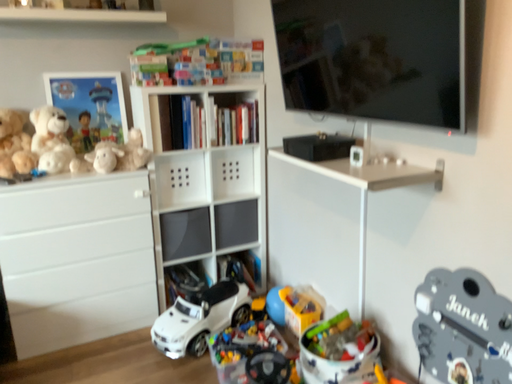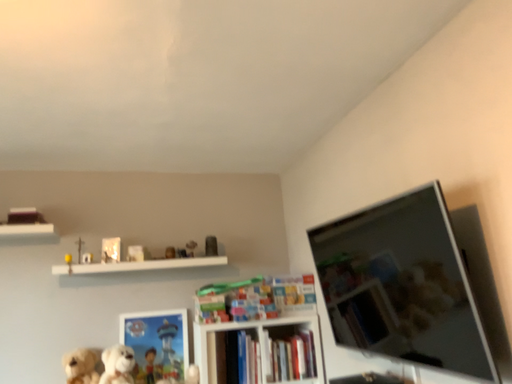
Question: How did the camera likely rotate when shooting the video?

Choices:
 (A) rotated upward
 (B) rotated downward

Answer: (A)